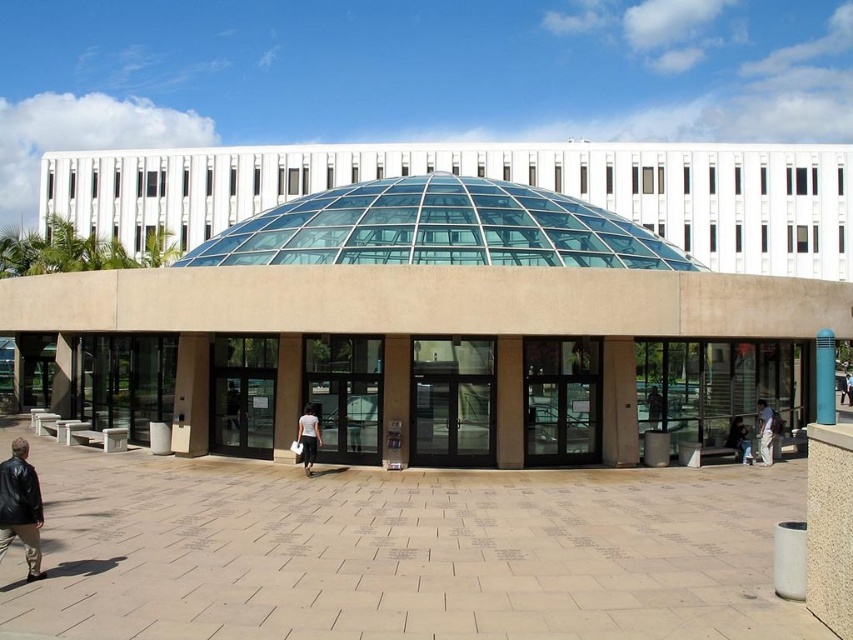
From the picture: Is clear glass door at center further to camera compared to light blue jeans at lower right?

No, clear glass door at center is in front of light blue jeans at lower right.

Who is more distant from viewer, (479, 397) or (730, 428)?

Point (730, 428)

Locate an element on the screen. clear glass door at center is located at coordinates (451, 401).

The height and width of the screenshot is (640, 853). In order to click on clear glass door at center in this screenshot , I will do `click(451, 401)`.

Does white fabric shirt at center have a larger size compared to blue fabric shirt at center?

No, white fabric shirt at center is not bigger than blue fabric shirt at center.

Who is more distant from viewer, (653,406) or (851,380)?

The point (851,380) is more distant.

Consider the image. Who is more distant from viewer, (653, 385) or (849, 388)?

The point (849, 388) is more distant.

At what (x,y) coordinates should I click in order to perform the action: click on white fabric shirt at center. Please return your answer as a coordinate pair (x, y). Image resolution: width=853 pixels, height=640 pixels. Looking at the image, I should click on (654, 406).

Can you confirm if transparent glass dome at center is bigger than leather jacket at lower left?

Indeed, transparent glass dome at center has a larger size compared to leather jacket at lower left.

Is point (527, 252) positioned behind point (0, 492)?

Yes, it is behind point (0, 492).

The image size is (853, 640). I want to click on transparent glass dome at center, so click(439, 228).